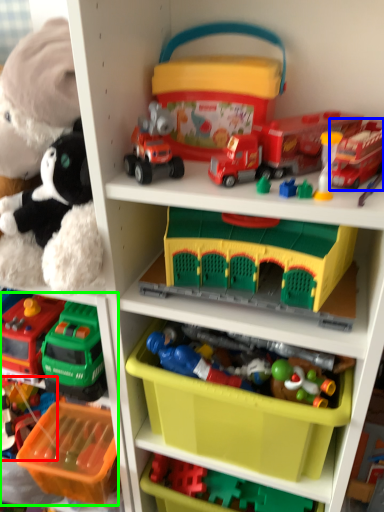
Question: Based on their relative distances, which object is nearer to toy (highlighted by a red box)? Choose from toy (highlighted by a blue box) and toy (highlighted by a green box).

Choices:
 (A) toy
 (B) toy

Answer: (B)